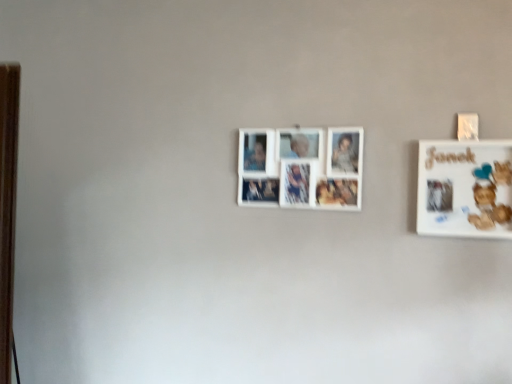
Question: From a real-world perspective, relative to white matte picture frame at center, the 2th picture frame in the right-to-left sequence, is white matte board at upper right, the 2th picture frame in the left-to-right sequence, vertically above or below?

Choices:
 (A) above
 (B) below

Answer: (B)

Question: Is point (461, 208) positioned closer to the camera than point (349, 180)?

Choices:
 (A) closer
 (B) farther

Answer: (A)

Question: From the image's perspective, relative to white matte picture frame at center, the 2th picture frame in the right-to-left sequence, is white matte board at upper right, the 2th picture frame from the back, above or below?

Choices:
 (A) below
 (B) above

Answer: (A)

Question: Does point pos(265,135) appear closer or farther from the camera than point pos(417,187)?

Choices:
 (A) farther
 (B) closer

Answer: (A)

Question: From a real-world perspective, is white matte picture frame at center, the 2th picture frame in the right-to-left sequence, above or below white matte board at upper right, the 2th picture frame in the left-to-right sequence?

Choices:
 (A) above
 (B) below

Answer: (A)

Question: Looking at their shapes, would you say white matte picture frame at center, the first picture frame positioned from the back, is wider or thinner than white matte board at upper right, the 1th picture frame when ordered from front to back?

Choices:
 (A) thin
 (B) wide

Answer: (A)

Question: Considering the positions of white matte picture frame at center, the 2th picture frame in the right-to-left sequence, and white matte board at upper right, the 2th picture frame from the back, in the image, is white matte picture frame at center, the 2th picture frame in the right-to-left sequence, taller or shorter than white matte board at upper right, the 2th picture frame from the back,?

Choices:
 (A) tall
 (B) short

Answer: (B)